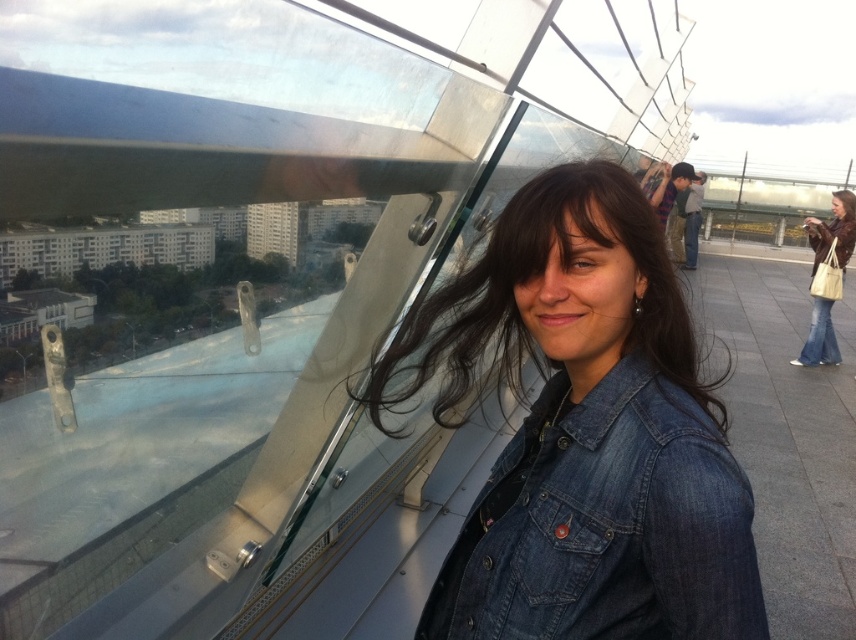
Question: Which point appears farthest from the camera in this image?

Choices:
 (A) pyautogui.click(x=114, y=241)
 (B) pyautogui.click(x=575, y=538)

Answer: (A)

Question: Can you confirm if denim jacket at lower right is positioned to the left of white glass building at upper left?

Choices:
 (A) yes
 (B) no

Answer: (B)

Question: Which of the following is the farthest from the observer?

Choices:
 (A) (836, 205)
 (B) (88, 227)
 (C) (550, 298)

Answer: (B)

Question: Which of these objects is positioned farthest from the matte brown leather jacket at lower right?

Choices:
 (A) white glass building at upper left
 (B) denim jacket at lower right
 (C) denim jacket at center

Answer: (A)

Question: Does white glass building at upper left appear on the left side of dark brown silky hair at upper center?

Choices:
 (A) yes
 (B) no

Answer: (A)

Question: Is denim jacket at lower right thinner than matte brown leather jacket at lower right?

Choices:
 (A) no
 (B) yes

Answer: (B)